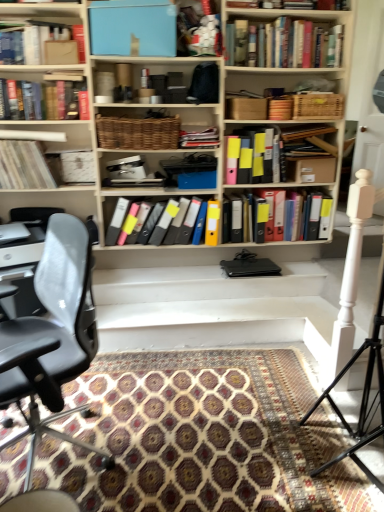
Question: Are black leather chair at left and white matte tripod at right located far from each other?

Choices:
 (A) no
 (B) yes

Answer: (B)

Question: Is black leather chair at left at the right side of white matte tripod at right?

Choices:
 (A) no
 (B) yes

Answer: (A)

Question: Does black leather chair at left have a smaller size compared to white matte tripod at right?

Choices:
 (A) no
 (B) yes

Answer: (A)

Question: Is black leather chair at left taller than white matte tripod at right?

Choices:
 (A) yes
 (B) no

Answer: (B)

Question: Is black leather chair at left at the left side of white matte tripod at right?

Choices:
 (A) no
 (B) yes

Answer: (B)

Question: Is black leather chair at left wider than white matte tripod at right?

Choices:
 (A) yes
 (B) no

Answer: (A)

Question: Does hardcover book at upper center, which ranks as the 1th book in top-to-bottom order, turn towards patterned carpet at center?

Choices:
 (A) yes
 (B) no

Answer: (B)

Question: Does hardcover book at upper center, acting as the eighth book starting from the bottom, have a larger size compared to patterned carpet at center?

Choices:
 (A) yes
 (B) no

Answer: (B)

Question: Is hardcover book at upper center, which ranks as the 1th book in top-to-bottom order, at the left side of patterned carpet at center?

Choices:
 (A) yes
 (B) no

Answer: (B)

Question: Does hardcover book at upper center, acting as the eighth book starting from the bottom, come behind patterned carpet at center?

Choices:
 (A) yes
 (B) no

Answer: (A)

Question: Is hardcover book at upper center, which ranks as the 1th book in top-to-bottom order, positioned in front of patterned carpet at center?

Choices:
 (A) yes
 (B) no

Answer: (B)

Question: Considering the relative sizes of hardcover book at upper center, acting as the eighth book starting from the bottom, and patterned carpet at center in the image provided, is hardcover book at upper center, acting as the eighth book starting from the bottom, shorter than patterned carpet at center?

Choices:
 (A) yes
 (B) no

Answer: (B)

Question: From the image's perspective, does hardcover book at upper left, the 5th book positioned from the bottom, appear lower than multicolored plastic folders at center, the 1th book from the bottom?

Choices:
 (A) yes
 (B) no

Answer: (B)